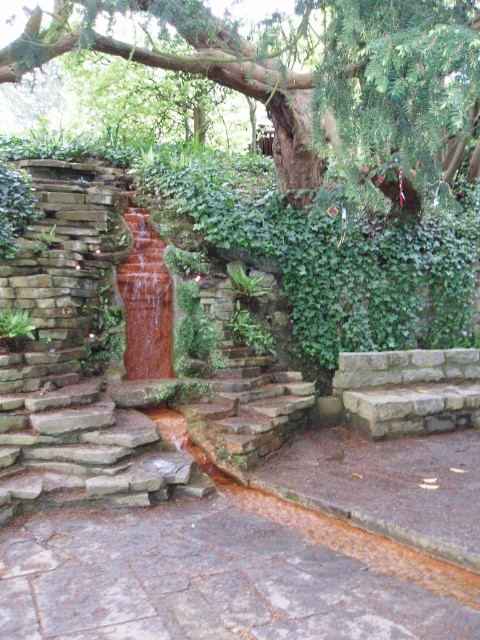
You are standing in the garden and want to take a photo of the waterfall. You notice a specific point at coordinates point (x=218, y=300). If your camera has a focal length of 50mm and you are currently 6 meters away from that point, should you move closer or farther away to focus on it properly?

The distance of point (x=218, y=300) from camera is 5.91 meters. Since you are currently 6 meters away, you should move slightly closer to match the 5.91 meter distance for proper focus.

You are standing at the base of the waterfall and want to climb up the brown stone stairs at center. Which direction should you move relative to the translucent amber water at center to reach the stairs?

You should move to the right of the translucent amber water at center to reach the brown stone stairs at center, as the brown stone stairs at center is located to the right of the water.